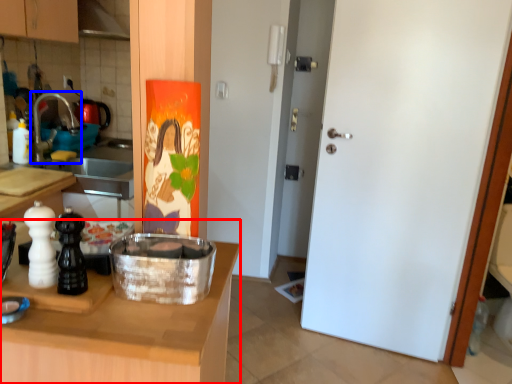
Question: Which point is further to the camera, countertop (highlighted by a red box) or faucet (highlighted by a blue box)?

Choices:
 (A) countertop
 (B) faucet

Answer: (B)